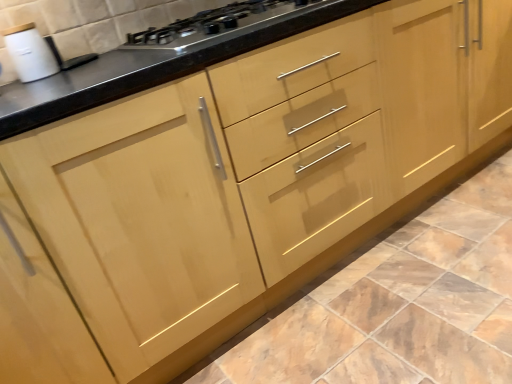
Question: In the image, is matte brown cabinet at center on the left side or the right side of white glossy sink at upper left?

Choices:
 (A) right
 (B) left

Answer: (A)

Question: Considering the positions of point (324, 337) and point (64, 67), is point (324, 337) closer or farther from the camera than point (64, 67)?

Choices:
 (A) farther
 (B) closer

Answer: (B)

Question: Which object is the closest to the satin black gas stove at upper center?

Choices:
 (A) white glossy sink at upper left
 (B) matte brown cabinet at center

Answer: (A)

Question: Which object is the closest to the matte brown cabinet at center?

Choices:
 (A) satin black gas stove at upper center
 (B) white glossy sink at upper left

Answer: (A)